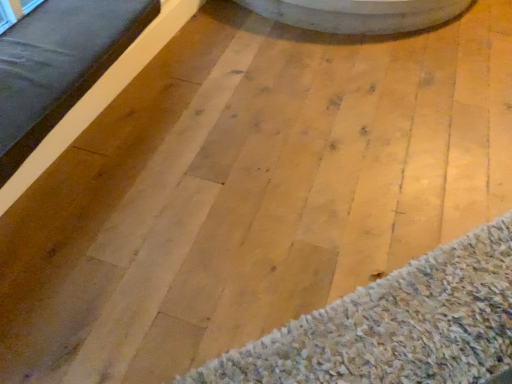
Image resolution: width=512 pixels, height=384 pixels. I want to click on vacant area on the back side of woolen carpet at lower right, so click(x=353, y=153).